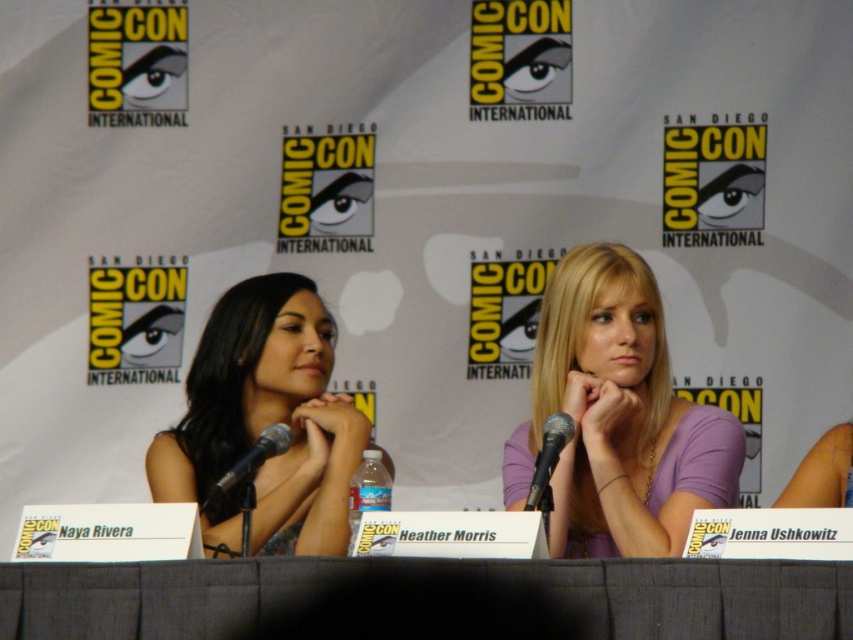
Question: Can you confirm if gray fabric table at center is wider than purple matte shirt at center?

Choices:
 (A) yes
 (B) no

Answer: (A)

Question: Does matte black dress at center appear on the right side of black metallic microphone at center?

Choices:
 (A) no
 (B) yes

Answer: (A)

Question: Which of these objects is positioned farthest from the metallic silver microphone at center?

Choices:
 (A) matte black dress at center
 (B) black metallic microphone at center

Answer: (A)

Question: Where is gray fabric table at center located in relation to metallic silver microphone at center in the image?

Choices:
 (A) left
 (B) right

Answer: (A)

Question: Which of these objects is positioned closest to the black metallic microphone at center?

Choices:
 (A) gray fabric table at center
 (B) metallic silver microphone at center

Answer: (A)

Question: Which point is closer to the camera?

Choices:
 (A) (233, 476)
 (B) (372, 444)
 (C) (569, 422)
 (D) (651, 564)

Answer: (D)